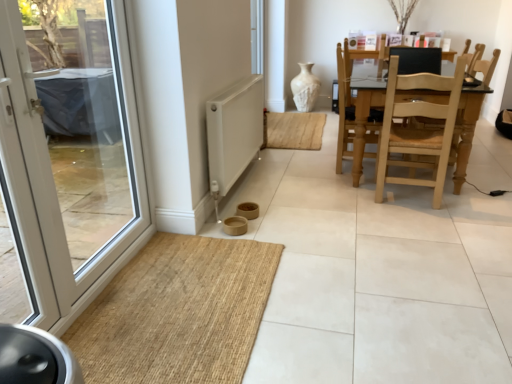
Locate an element on the screen. free space in front of light wood/wooden chair at right is located at coordinates [x=432, y=223].